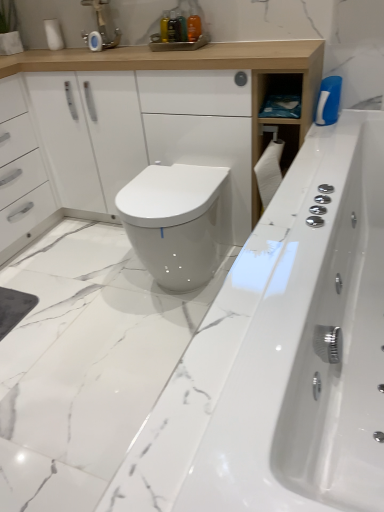
Question: Does white glossy bathtub at center appear on the right side of white glossy bidet at center?

Choices:
 (A) yes
 (B) no

Answer: (A)

Question: Can white glossy bidet at center be found inside white glossy bathtub at center?

Choices:
 (A) no
 (B) yes

Answer: (A)

Question: From a real-world perspective, is white glossy bathtub at center under white glossy bidet at center?

Choices:
 (A) yes
 (B) no

Answer: (B)

Question: Is white glossy bathtub at center positioned with its back to white glossy bidet at center?

Choices:
 (A) yes
 (B) no

Answer: (A)

Question: Considering the relative sizes of white glossy bathtub at center and white glossy bidet at center in the image provided, is white glossy bathtub at center bigger than white glossy bidet at center?

Choices:
 (A) no
 (B) yes

Answer: (B)

Question: From a real-world perspective, is white matte toilet paper at upper left above or below white glossy bidet at center?

Choices:
 (A) above
 (B) below

Answer: (A)

Question: Considering the positions of white matte toilet paper at upper left and white glossy bidet at center in the image, is white matte toilet paper at upper left taller or shorter than white glossy bidet at center?

Choices:
 (A) short
 (B) tall

Answer: (A)

Question: Looking at their shapes, would you say white matte toilet paper at upper left is wider or thinner than white glossy bidet at center?

Choices:
 (A) thin
 (B) wide

Answer: (A)

Question: In the image, is white matte toilet paper at upper left on the left side or the right side of white glossy bidet at center?

Choices:
 (A) right
 (B) left

Answer: (B)

Question: Looking at their shapes, would you say white matte toilet paper at upper left is wider or thinner than white glossy cabinet at upper center?

Choices:
 (A) wide
 (B) thin

Answer: (B)

Question: Based on their sizes in the image, would you say white matte toilet paper at upper left is bigger or smaller than white glossy cabinet at upper center?

Choices:
 (A) big
 (B) small

Answer: (B)

Question: Which is correct: white matte toilet paper at upper left is inside white glossy cabinet at upper center, or outside of it?

Choices:
 (A) outside
 (B) inside

Answer: (A)

Question: From a real-world perspective, is white matte toilet paper at upper left positioned above or below white glossy cabinet at upper center?

Choices:
 (A) below
 (B) above

Answer: (B)

Question: From their relative heights in the image, would you say white matte toilet paper at upper left is taller or shorter than matte silver faucet at upper center?

Choices:
 (A) tall
 (B) short

Answer: (B)

Question: Looking at the image, does white matte toilet paper at upper left seem bigger or smaller compared to matte silver faucet at upper center?

Choices:
 (A) big
 (B) small

Answer: (B)